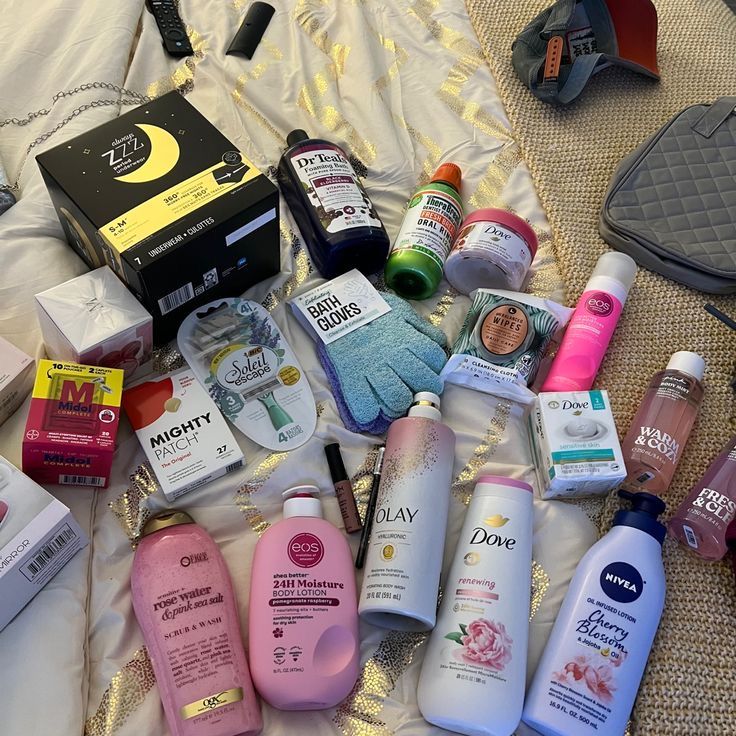
The image size is (736, 736). Find the location of `bottle`. bottle is located at coordinates (205, 647), (319, 573), (402, 511), (494, 590), (629, 631), (723, 517), (665, 417), (590, 339), (327, 202), (439, 219).